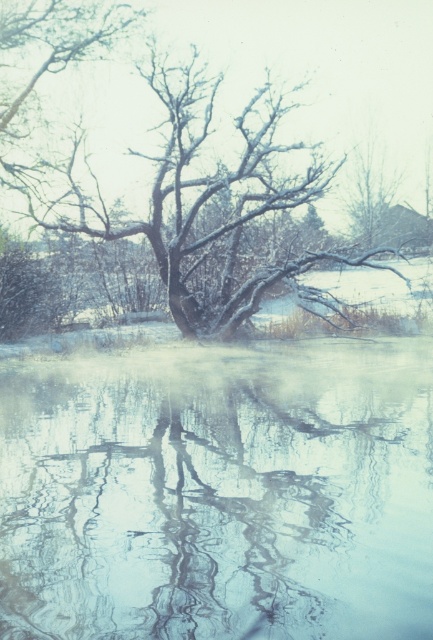
You are standing at the point with coordinates point (97, 52) and want to walk to the point with coordinates point (426, 512). Which direction should you move?

You should move forward because point (426, 512) is in front of point (97, 52).